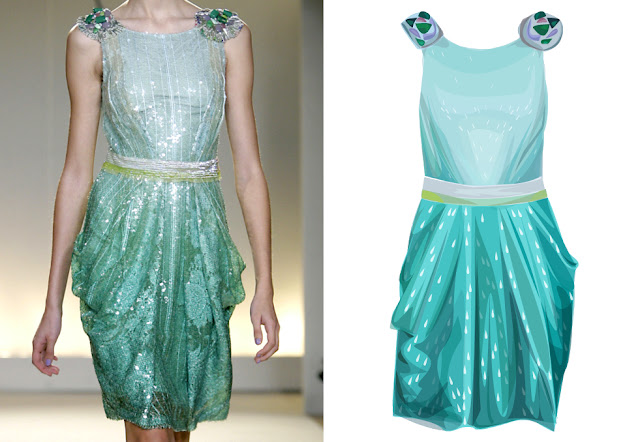
Image resolution: width=640 pixels, height=442 pixels. In order to click on beige floor in this screenshot , I will do `click(273, 427)`.